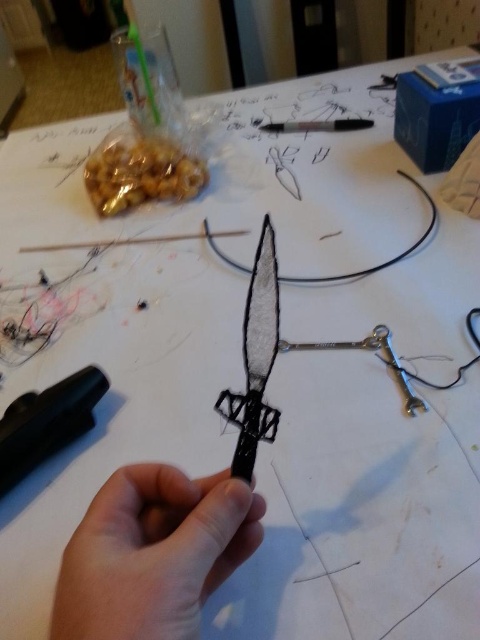
In the scene shown: You are an artist who needs to cut a piece of paper precisely. You have the metallic silver scissors at center and the black plastic pen at center on the table. Which object should you pick up first if you want to reach the scissors before the pen?

The metallic silver scissors at center is to the left of the black plastic pen at center, so you should pick up the metallic silver scissors at center first since it is closer to your left hand.

You are an artist working on a project and need to choose between the black matte knife at center and the metallic silver scissors at center. Which object is bigger?

The black matte knife at center is larger in size than the metallic silver scissors at center.

You are a craftsperson working on a project and need to place both the black matte knife at center and the metallic silver scissors at center on a shelf. If the shelf has a height limit of 10 cm, can both items fit vertically without exceeding the height restriction?

The black matte knife at center is taller than the metallic silver scissors at center. However, the description does not provide specific measurements for their heights. Without knowing the exact heights of both items, it is impossible to determine if they will fit within the 10 cm height limit on the shelf.